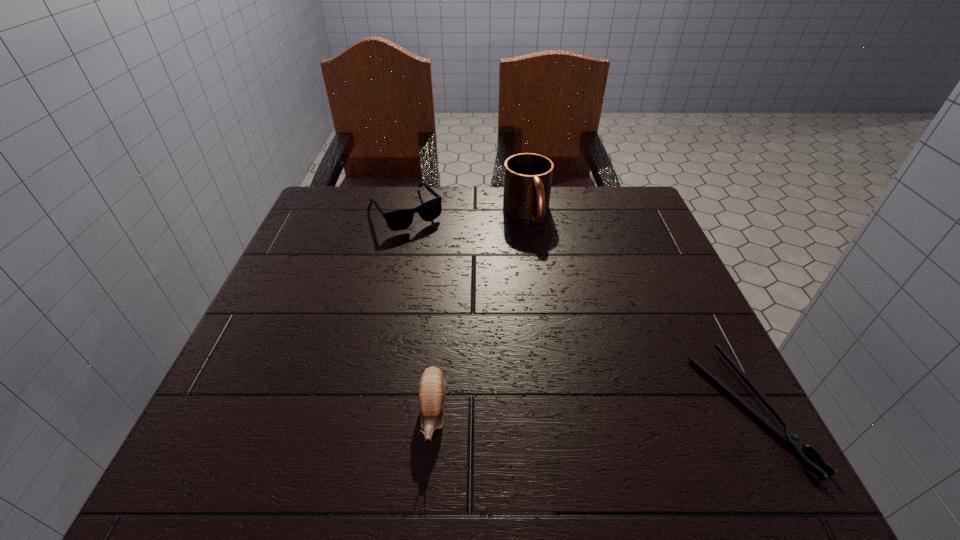
Identify the location of free space located 0.310m on the side of the tallest object with the handle. (578, 321).

At what (x,y) coordinates should I click in order to perform the action: click on free location located 0.300m on the side of the tallest object with the handle. Please return your answer as a coordinate pair (x, y). The width and height of the screenshot is (960, 540). Looking at the image, I should click on 576,317.

Where is `free space located on the side of the tallest object with the handle`? The width and height of the screenshot is (960, 540). free space located on the side of the tallest object with the handle is located at coordinates (546, 256).

This screenshot has width=960, height=540. Identify the location of sunglasses located in the far edge section of the desktop. coord(397,220).

At what (x,y) coordinates should I click in order to perform the action: click on mug present at the far edge. Please return your answer as a coordinate pair (x, y). This screenshot has height=540, width=960. Looking at the image, I should click on (527, 176).

Identify the location of escargot located in the near edge section of the desktop. The image size is (960, 540). (432, 388).

Where is `tongs that is at the near edge`? Image resolution: width=960 pixels, height=540 pixels. tongs that is at the near edge is located at coordinates (791, 437).

Find the location of a particular element. object at the left edge is located at coordinates (397, 220).

At what (x,y) coordinates should I click in order to perform the action: click on object located at the right edge. Please return your answer as a coordinate pair (x, y). The height and width of the screenshot is (540, 960). Looking at the image, I should click on (791, 437).

At what (x,y) coordinates should I click in order to perform the action: click on object that is at the far left corner. Please return your answer as a coordinate pair (x, y). The width and height of the screenshot is (960, 540). Looking at the image, I should click on (397, 220).